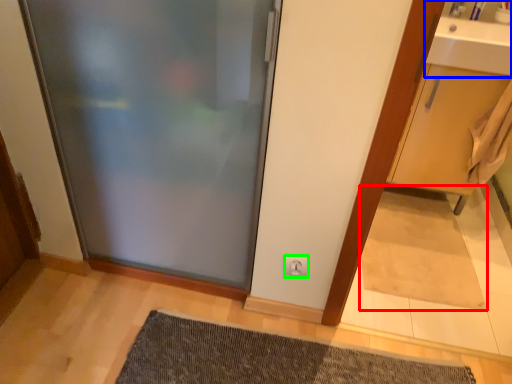
Question: Which object is the farthest from doormat (highlighted by a red box)? Choose among these: sink (highlighted by a blue box) or electric outlet (highlighted by a green box).

Choices:
 (A) sink
 (B) electric outlet

Answer: (A)